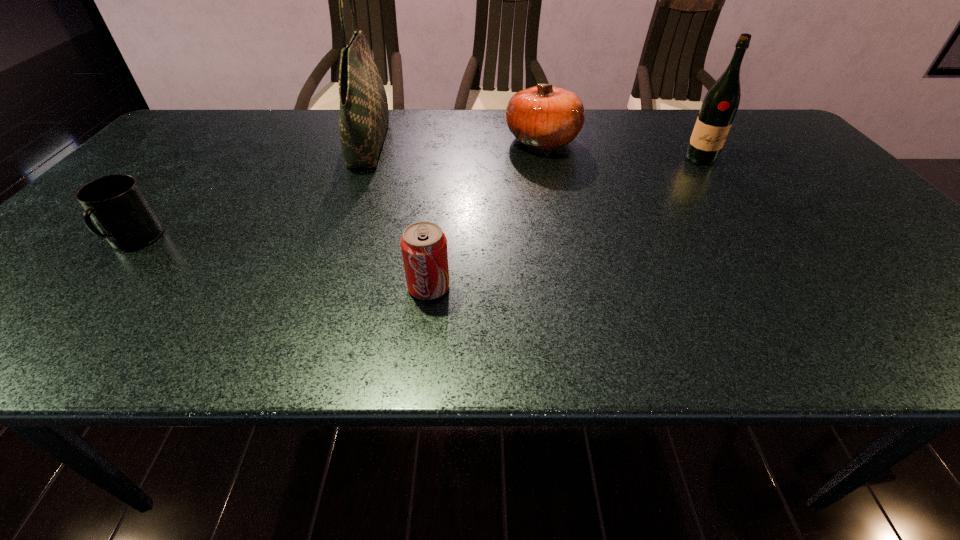
Where is `free space located 0.110m on the front-facing side of the rightmost object`? The height and width of the screenshot is (540, 960). free space located 0.110m on the front-facing side of the rightmost object is located at coordinates (722, 188).

Where is `free point located 0.250m on the right of the pumpkin`? This screenshot has width=960, height=540. free point located 0.250m on the right of the pumpkin is located at coordinates (664, 141).

Identify the location of vacant space located on the right of the third object from right to left. [501, 287].

Find the location of a particular element. The image size is (960, 540). free spot located on the side of the mug with the handle is located at coordinates (81, 301).

Where is `tote bag located at the far edge`? tote bag located at the far edge is located at coordinates (364, 116).

Image resolution: width=960 pixels, height=540 pixels. In order to click on pumpkin at the far edge in this screenshot , I will do `click(544, 117)`.

Identify the location of object at the left edge. The width and height of the screenshot is (960, 540). (116, 204).

At what (x,y) coordinates should I click in order to perform the action: click on free region at the far edge of the desktop. Please return your answer as a coordinate pair (x, y). The width and height of the screenshot is (960, 540). Looking at the image, I should click on (610, 114).

Where is `blank space at the near edge`? This screenshot has height=540, width=960. blank space at the near edge is located at coordinates pyautogui.click(x=811, y=322).

At what (x,y) coordinates should I click in order to perform the action: click on vacant region at the left edge of the desktop. Please return your answer as a coordinate pair (x, y). The image size is (960, 540). Looking at the image, I should click on (145, 190).